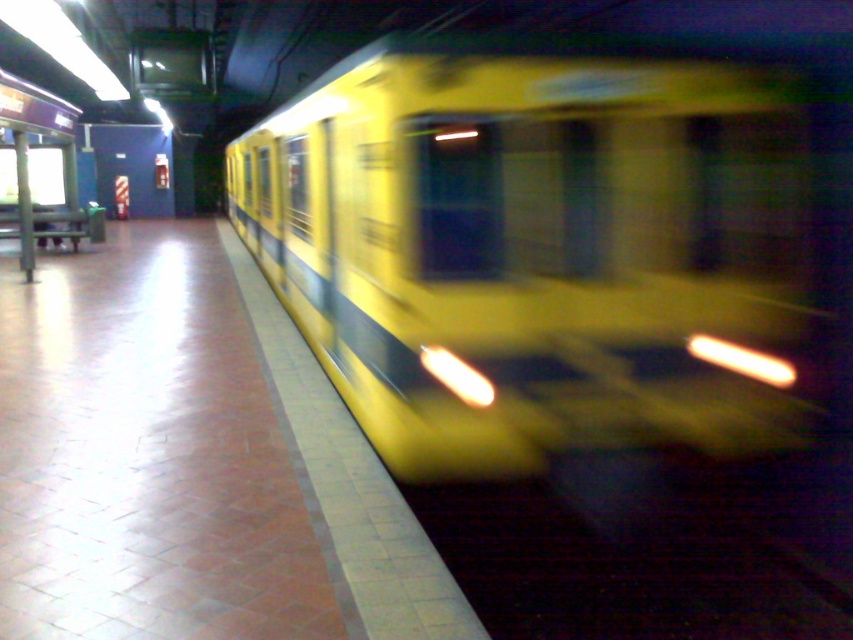
Which is more to the left, yellow matte train at center or dark rubber train track at lower right?

yellow matte train at center

Does yellow matte train at center have a smaller size compared to dark rubber train track at lower right?

No, yellow matte train at center is not smaller than dark rubber train track at lower right.

Which is in front, point (432, 452) or point (503, 572)?

Point (503, 572) is more forward.

Locate an element on the screen. The image size is (853, 640). yellow matte train at center is located at coordinates (550, 244).